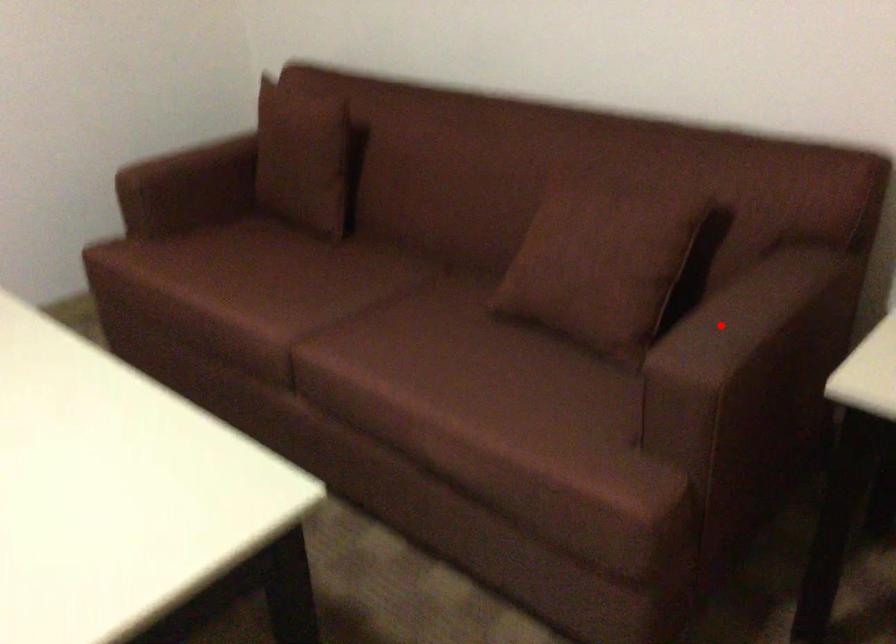
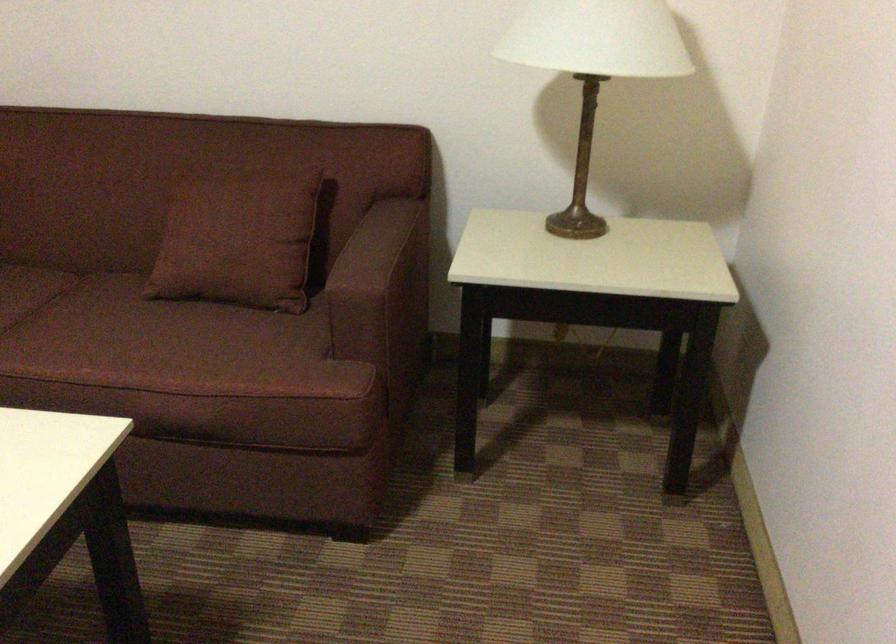
In the second image, find the point that corresponds to the highlighted location in the first image.

(367, 254)